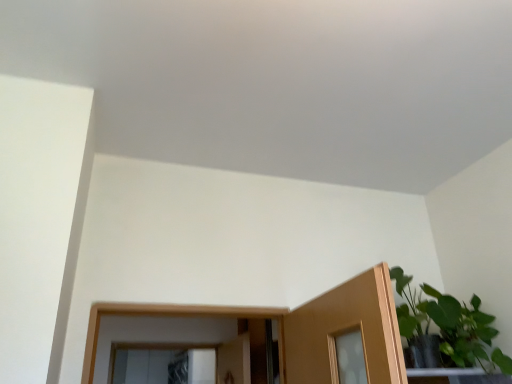
Question: Should I look upward or downward to see green leafy plant at upper right?

Choices:
 (A) down
 (B) up

Answer: (A)